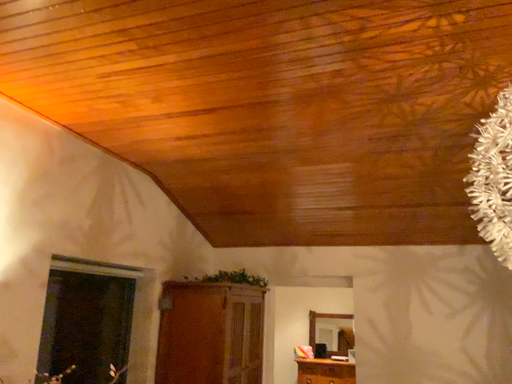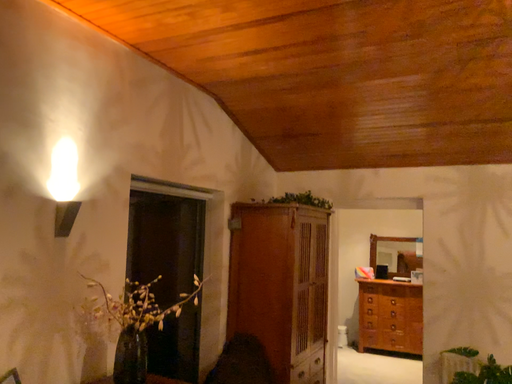
Question: How did the camera likely rotate when shooting the video?

Choices:
 (A) rotated downward
 (B) rotated upward

Answer: (A)